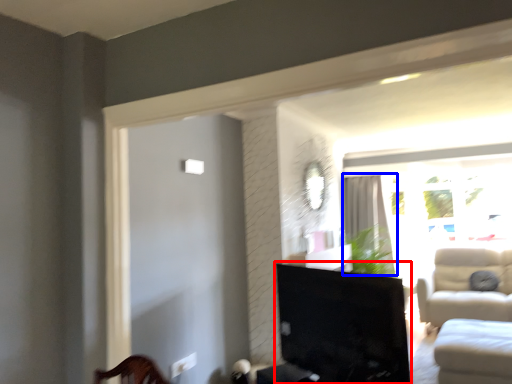
Question: Among these objects, which one is farthest to the camera, furniture (highlighted by a red box) or curtain (highlighted by a blue box)?

Choices:
 (A) furniture
 (B) curtain

Answer: (B)